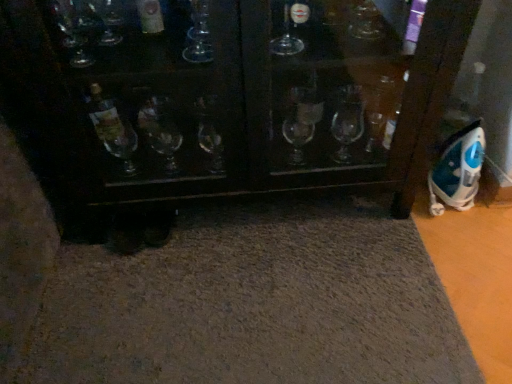
Locate an element on the screen. This screenshot has height=384, width=512. vacant region below gray carpet at lower center (from a real-world perspective) is located at coordinates (234, 284).